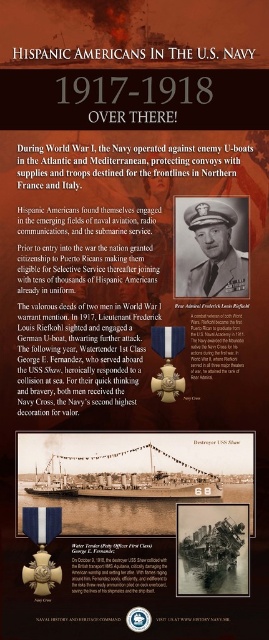
Can you confirm if matte black uniform at center is positioned below wooden ship at lower left?

No.

Between point (217, 252) and point (58, 468), which one is positioned behind?

Point (217, 252)

The image size is (269, 640). In order to click on matte black uniform at center in this screenshot , I will do `click(216, 252)`.

Is sepia-toned steel battleship at center bigger than matte black uniform at center?

Yes.

Is sepia-toned steel battleship at center wider than matte black uniform at center?

Indeed, sepia-toned steel battleship at center has a greater width compared to matte black uniform at center.

Who is more forward, (150, 476) or (197, 296)?

Point (150, 476)

Locate an element on the screen. sepia-toned steel battleship at center is located at coordinates coord(125,477).

I want to click on sepia-toned steel battleship at center, so click(x=125, y=477).

The width and height of the screenshot is (269, 640). I want to click on sepia-toned steel battleship at center, so pos(125,477).

This screenshot has height=640, width=269. I want to click on sepia-toned steel battleship at center, so click(125, 477).